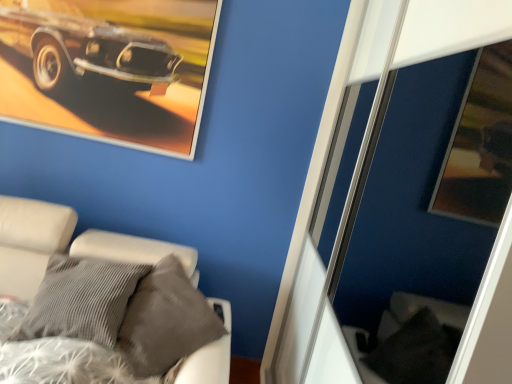
Question: Is metallic silver picture frame at upper left to the left or to the right of white fabric bed at lower left in the image?

Choices:
 (A) right
 (B) left

Answer: (B)

Question: Based on their sizes in the image, would you say metallic silver picture frame at upper left is bigger or smaller than white fabric bed at lower left?

Choices:
 (A) small
 (B) big

Answer: (A)

Question: From their relative heights in the image, would you say metallic silver picture frame at upper left is taller or shorter than white fabric bed at lower left?

Choices:
 (A) tall
 (B) short

Answer: (B)

Question: Is white fabric bed at lower left situated inside metallic silver picture frame at upper left or outside?

Choices:
 (A) inside
 (B) outside

Answer: (B)

Question: Is white fabric bed at lower left in front of or behind metallic silver picture frame at upper left in the image?

Choices:
 (A) behind
 (B) front

Answer: (B)

Question: From a real-world perspective, is white fabric bed at lower left above or below metallic silver picture frame at upper left?

Choices:
 (A) above
 (B) below

Answer: (B)

Question: From the image's perspective, relative to metallic silver picture frame at upper left, is white fabric bed at lower left above or below?

Choices:
 (A) below
 (B) above

Answer: (A)